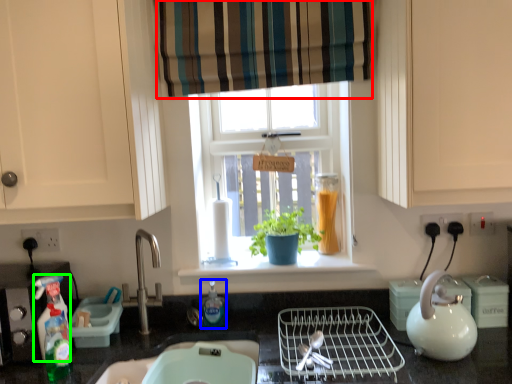
Question: Which object is the closest to the curtain (highlighted by a red box)? Choose among these: bottle (highlighted by a blue box) or cleaning product (highlighted by a green box).

Choices:
 (A) bottle
 (B) cleaning product

Answer: (A)